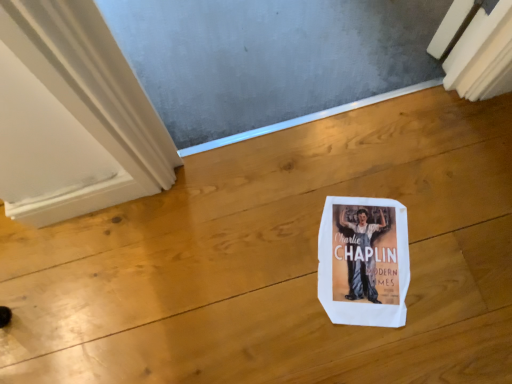
Image resolution: width=512 pixels, height=384 pixels. I want to click on free region on the left part of white paper bag at center, so click(x=268, y=269).